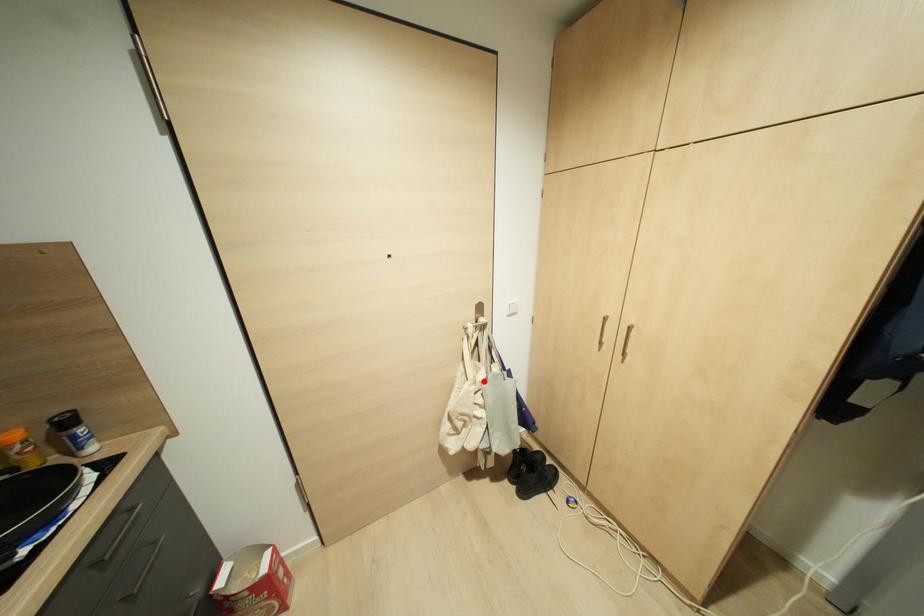
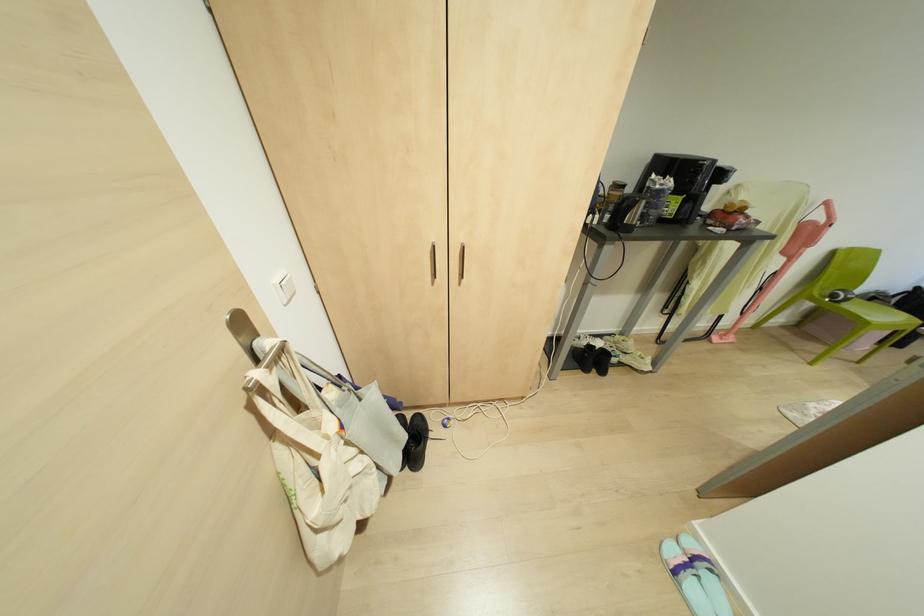
Where in the second image is the point corresponding to the highlighted location from the first image?

(342, 426)